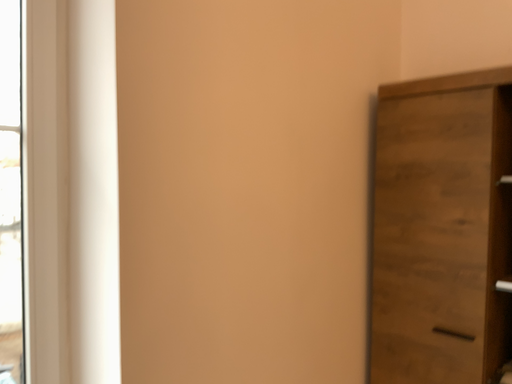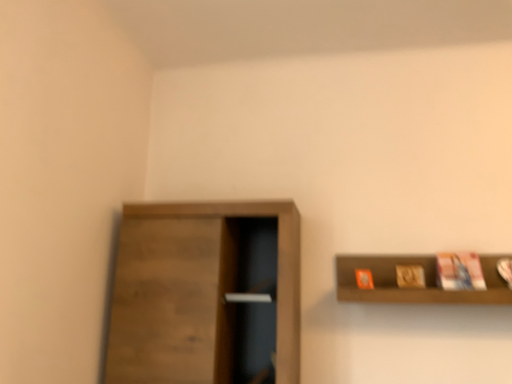
Question: How did the camera likely rotate when shooting the video?

Choices:
 (A) rotated upward
 (B) rotated downward

Answer: (A)